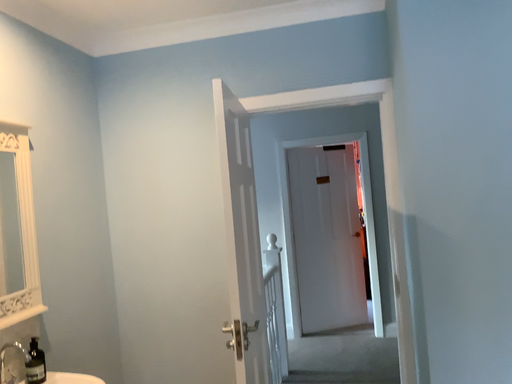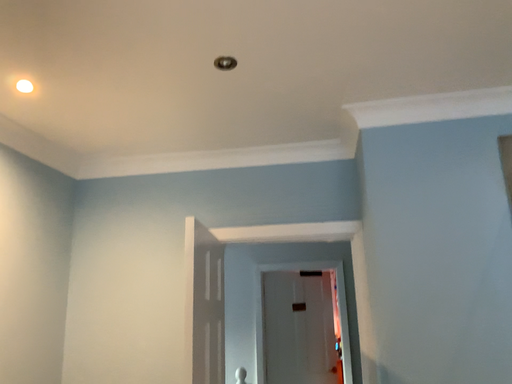
Question: How did the camera likely rotate when shooting the video?

Choices:
 (A) rotated downward
 (B) rotated upward

Answer: (B)